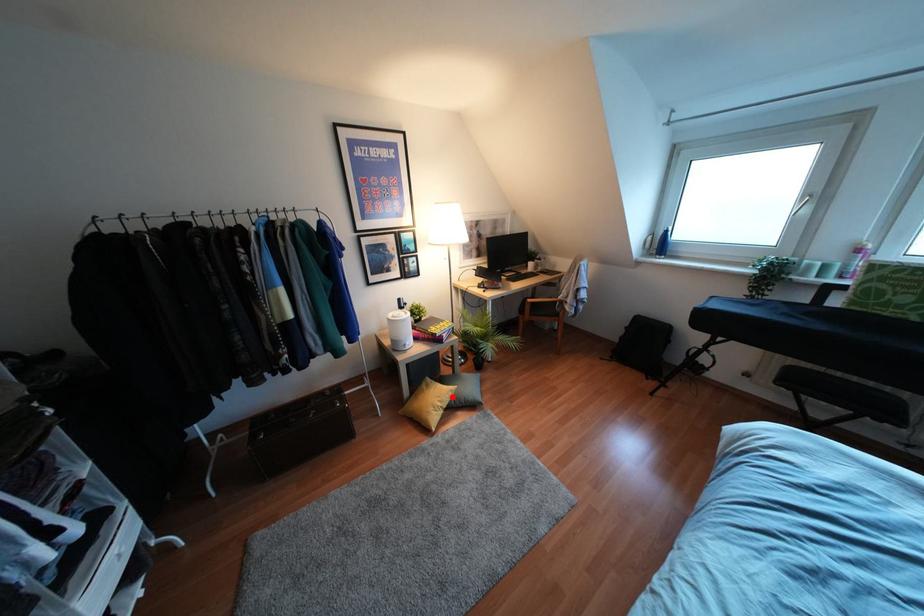
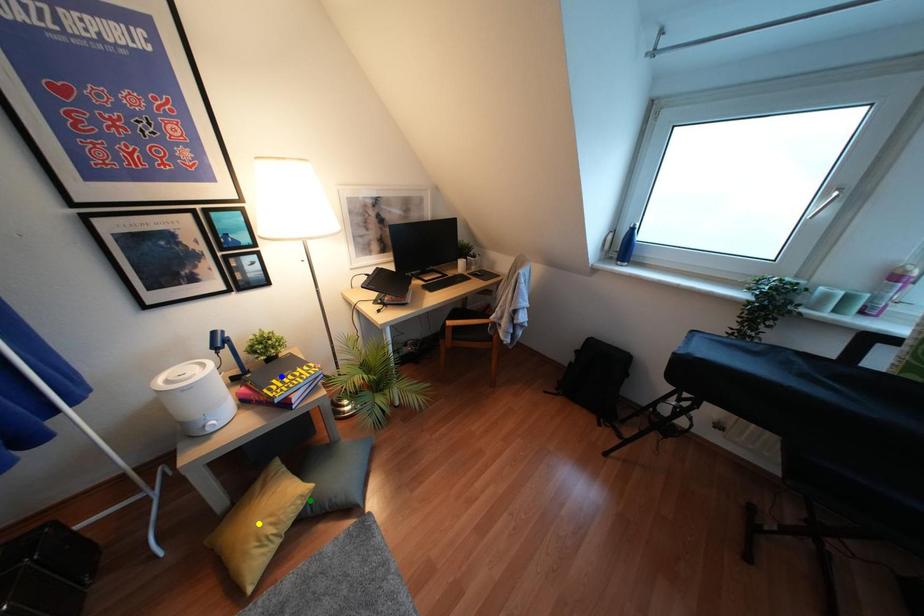
Question: I am providing you with two images of the same scene from different viewpoints. A red point is marked on the first image. You are given multiple points on the second image. Which mark in image 2 goes with the point in image 1?

Choices:
 (A) green point
 (B) blue point
 (C) yellow point

Answer: (A)